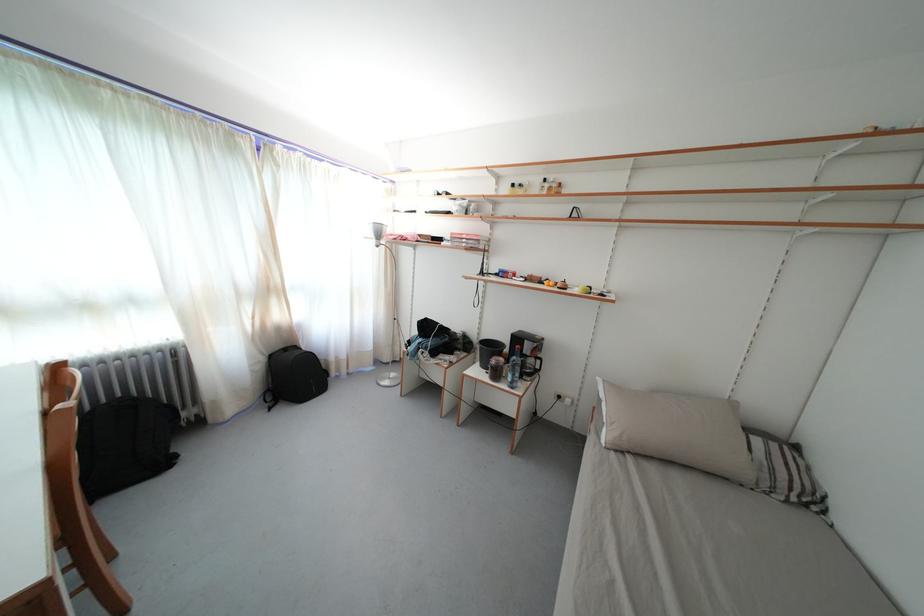
Image resolution: width=924 pixels, height=616 pixels. What do you see at coordinates (676, 430) in the screenshot?
I see `a grey pillow` at bounding box center [676, 430].